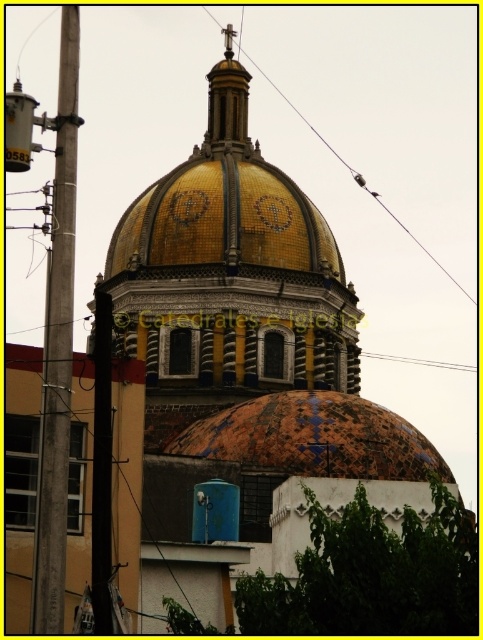
Which of these two, rusty ceramic dome at center or metallic wire at upper center, stands shorter?

Standing shorter between the two is rusty ceramic dome at center.

Measure the distance from rusty ceramic dome at center to metallic wire at upper center.

rusty ceramic dome at center is 179.97 feet from metallic wire at upper center.

Does point (355, 444) come in front of point (211, 17)?

That is True.

This screenshot has height=640, width=483. I want to click on rusty ceramic dome at center, so click(x=312, y=436).

Between point (170, 205) and point (428, 252), which one is positioned in front?

Point (170, 205) is in front.

Looking at this image, who is positioned more to the right, gold mosaic dome at center or metallic wire at upper center?

metallic wire at upper center is more to the right.

Which is in front, point (130, 214) or point (384, 205)?

Point (130, 214) is more forward.

Identify the location of gold mosaic dome at center. (230, 268).

Between gold mosaic dome at center and rusty ceramic dome at center, which one is positioned higher?

gold mosaic dome at center is above.

From the picture: Is gold mosaic dome at center wider than rusty ceramic dome at center?

Yes, gold mosaic dome at center is wider than rusty ceramic dome at center.

Does point (124, 224) lie in front of point (239, 433)?

No, it is not.

You are a GUI agent. You are given a task and a screenshot of the screen. Output one action in this format:
    pyautogui.click(x=<x>, y=<y>)
    Task: Click on the gold mosaic dome at center
    
    Given the screenshot: What is the action you would take?
    pyautogui.click(x=230, y=268)